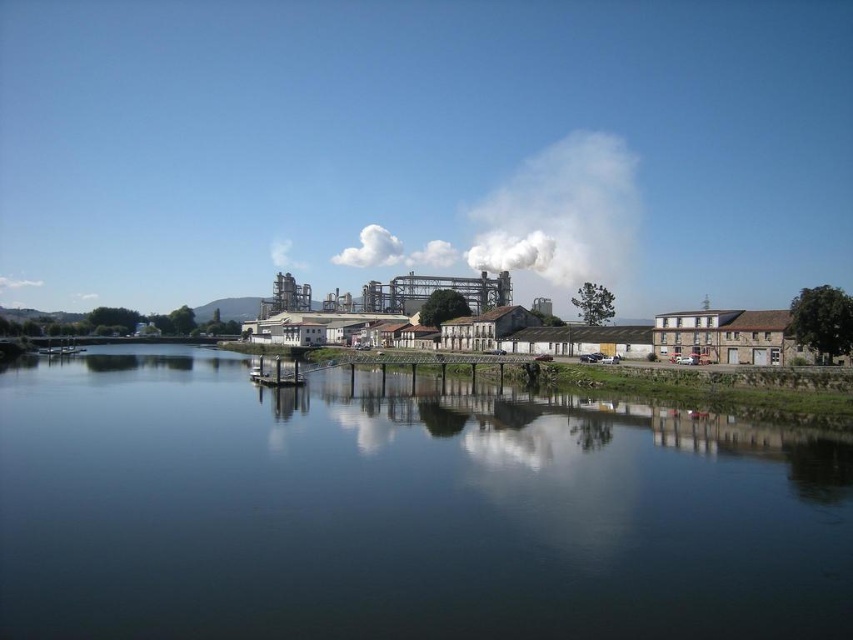
Question: Observing the image, what is the correct spatial positioning of dark blue water at center in reference to white smoke at upper center?

Choices:
 (A) above
 (B) below

Answer: (B)

Question: Among these points, which one is nearest to the camera?

Choices:
 (A) (596, 280)
 (B) (80, 369)

Answer: (B)

Question: Is dark blue water at center positioned before white smoke at upper center?

Choices:
 (A) yes
 (B) no

Answer: (A)

Question: Does dark blue water at center appear on the left side of white smoke at upper center?

Choices:
 (A) yes
 (B) no

Answer: (A)

Question: Which of the following is the closest to the observer?

Choices:
 (A) (659, 448)
 (B) (496, 211)

Answer: (A)

Question: Which point is farther to the camera?

Choices:
 (A) (608, 230)
 (B) (0, 596)

Answer: (A)